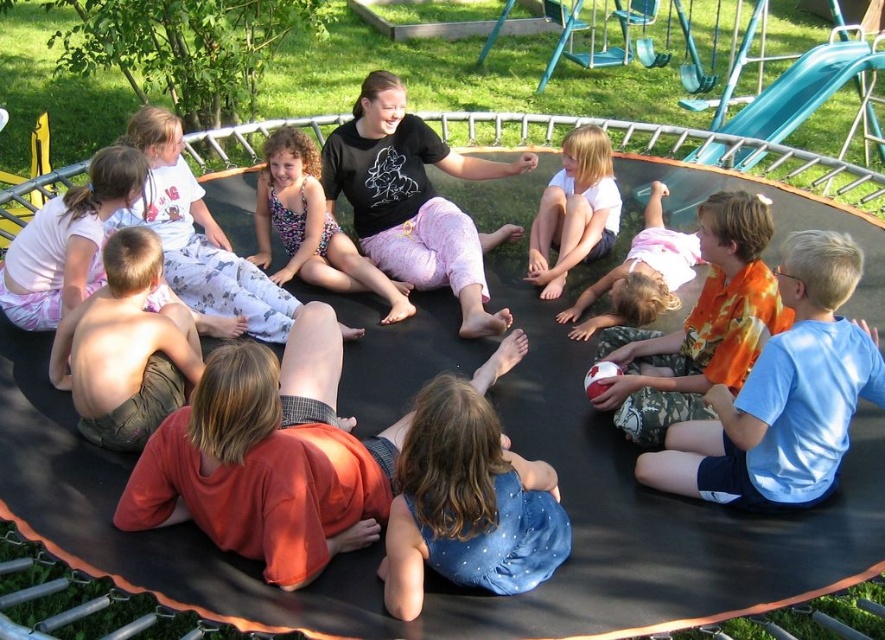
You are a photographer standing to the left of the trampoline. You want to take a photo of the blue cotton shirt at lower right and the white cotton shirt at center. Which shirt should you move to the left to frame them better?

The blue cotton shirt at lower right is to the right of white cotton shirt at center. To frame them better, move the blue cotton shirt at lower right to the left so it aligns more centrally with the white cotton shirt at center.